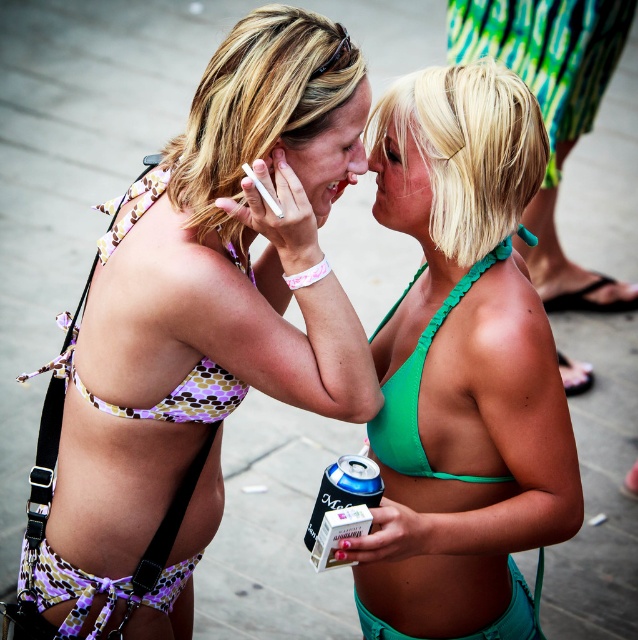
Between point (408, 403) and point (163, 605), which one is positioned behind?

The point (163, 605) is behind.

Between point (389, 419) and point (163, 602), which one is positioned in front?

Point (389, 419) is in front.

Measure the distance between green fabric bikini top at center and camera.

green fabric bikini top at center and camera are 7.22 feet apart from each other.

I want to click on green fabric bikini top at center, so click(419, 390).

Which is in front, point (182, 360) or point (475, 182)?

Point (475, 182)

Does matte purple bikini top at center have a greater height compared to green matte bikini top at center?

Correct, matte purple bikini top at center is much taller as green matte bikini top at center.

Does point (223, 364) lie in front of point (410, 586)?

That is True.

Locate an element on the screen. This screenshot has width=638, height=640. matte purple bikini top at center is located at coordinates (204, 323).

What do you see at coordinates (204, 323) in the screenshot? The height and width of the screenshot is (640, 638). I see `matte purple bikini top at center` at bounding box center [204, 323].

Can you confirm if matte purple bikini top at center is positioned below purple polka dot bikini top at upper left?

Yes, matte purple bikini top at center is below purple polka dot bikini top at upper left.

You are a GUI agent. You are given a task and a screenshot of the screen. Output one action in this format:
    pyautogui.click(x=<x>, y=<y>)
    Task: Click on the matte purple bikini top at center
    The height and width of the screenshot is (640, 638).
    Given the screenshot: What is the action you would take?
    pyautogui.click(x=204, y=323)